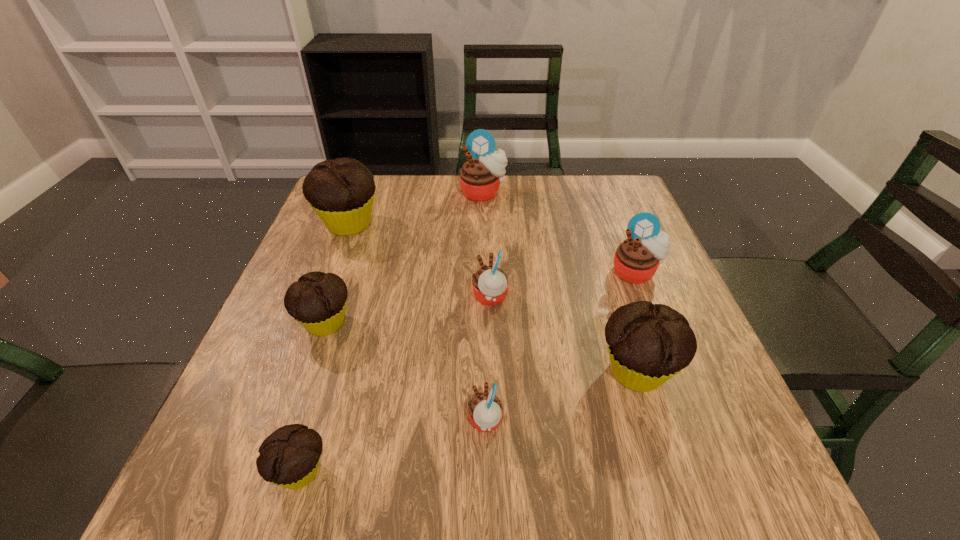
Where is `muffin that is the second closest to the farthest muffin`? muffin that is the second closest to the farthest muffin is located at coordinates (490, 284).

Select which pink muffin appears as the third closest to the third biggest pink muffin. Please provide its 2D coordinates. Your answer should be formatted as a tuple, i.e. [(x, y)], where the tuple contains the x and y coordinates of a point satisfying the conditions above.

[(480, 177)]

You are a GUI agent. You are given a task and a screenshot of the screen. Output one action in this format:
    pyautogui.click(x=<x>, y=<y>)
    Task: Click on the pink muffin that is the third closest to the second biggest pink muffin
    
    Given the screenshot: What is the action you would take?
    pyautogui.click(x=485, y=410)

Identify which chocolate muffin is the second nearest to the third smallest pink muffin. Please provide its 2D coordinates. Your answer should be formatted as a tuple, i.e. [(x, y)], where the tuple contains the x and y coordinates of a point satisfying the conditions above.

[(341, 191)]

Identify which chocolate muffin is located as the nearest to the second biggest chocolate muffin. Please provide its 2D coordinates. Your answer should be formatted as a tuple, i.e. [(x, y)], where the tuple contains the x and y coordinates of a point satisfying the conditions above.

[(289, 457)]

The image size is (960, 540). I want to click on free location that satisfies the following two spatial constraints: 1. on the front side of the rightmost chocolate muffin; 2. on the right side of the farthest chocolate muffin, so click(x=293, y=371).

Where is `vacant region that satisfies the following two spatial constraints: 1. on the front side of the seventh nearest object; 2. on the left side of the third smallest chocolate muffin`? vacant region that satisfies the following two spatial constraints: 1. on the front side of the seventh nearest object; 2. on the left side of the third smallest chocolate muffin is located at coordinates (293, 371).

Find the location of a particular element. vacant space that satisfies the following two spatial constraints: 1. on the front-facing side of the second smallest pink muffin; 2. on the back side of the rightmost chocolate muffin is located at coordinates (492, 371).